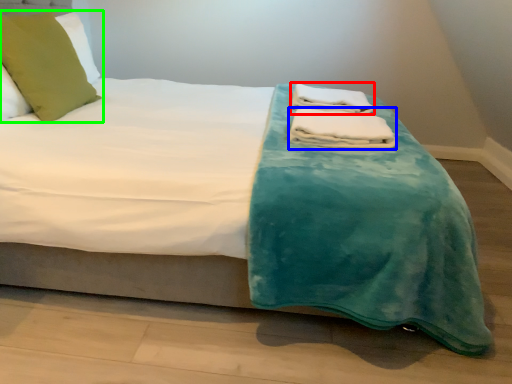
Question: Based on their relative distances, which object is nearer to bath towel (highlighted by a red box)? Choose from bath towel (highlighted by a blue box) and pillow (highlighted by a green box).

Choices:
 (A) bath towel
 (B) pillow

Answer: (A)